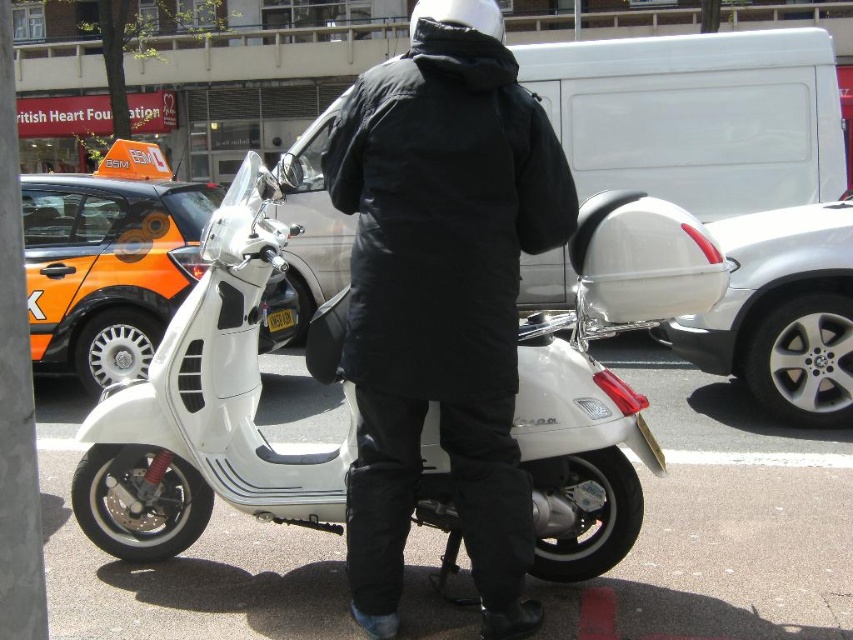
Is black matte jacket at center below black plastic license plate at center?

Indeed, black matte jacket at center is positioned under black plastic license plate at center.

Who is positioned more to the right, black matte jacket at center or black plastic license plate at center?

From the viewer's perspective, black matte jacket at center appears more on the right side.

Is point (511, 337) positioned after point (294, 317)?

No, (511, 337) is in front of (294, 317).

Locate an element on the screen. black matte jacket at center is located at coordinates (442, 298).

Is white matte scooter at center shorter than black plastic license plate at center?

No, white matte scooter at center is not shorter than black plastic license plate at center.

Is the position of white matte scooter at center less distant than that of black plastic license plate at center?

Yes, it is.

Where is `white matte scooter at center`? The height and width of the screenshot is (640, 853). white matte scooter at center is located at coordinates (206, 410).

Can you confirm if white matte scooter at center is positioned below black matte jacket at center?

Answer: Indeed, white matte scooter at center is positioned under black matte jacket at center.

This screenshot has width=853, height=640. In order to click on white matte scooter at center in this screenshot , I will do `click(206, 410)`.

I want to click on white matte scooter at center, so click(x=206, y=410).

Image resolution: width=853 pixels, height=640 pixels. I want to click on white matte scooter at center, so click(x=206, y=410).